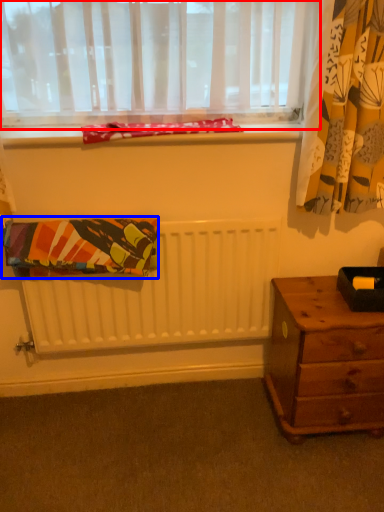
Question: Which point is further to the camera, window (highlighted by a red box) or blanket (highlighted by a blue box)?

Choices:
 (A) window
 (B) blanket

Answer: (B)